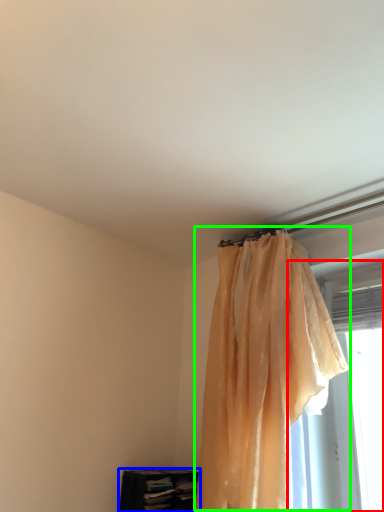
Question: Which object is the farthest from window (highlighted by a red box)? Choose among these: furniture (highlighted by a blue box) or curtain (highlighted by a green box).

Choices:
 (A) furniture
 (B) curtain

Answer: (A)